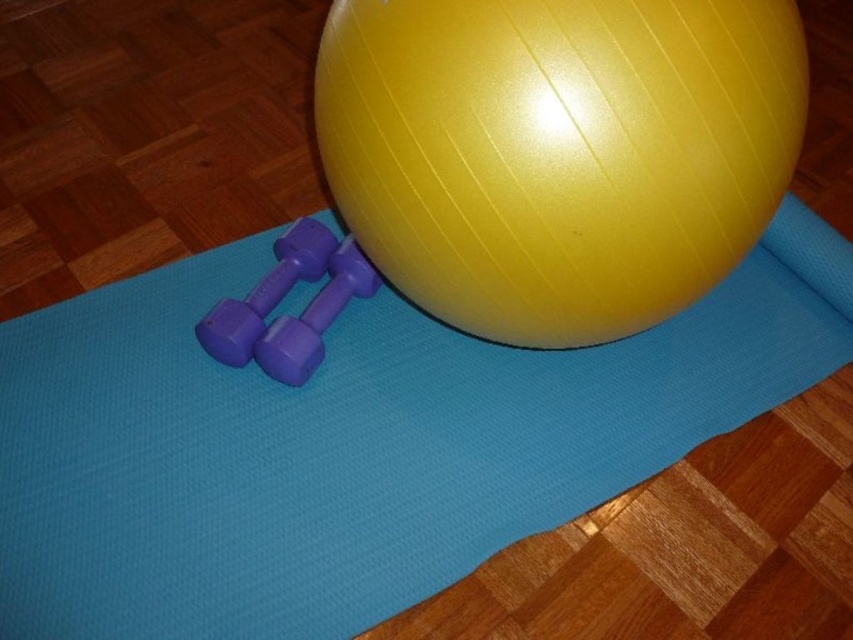
You are organizing a fitness class and need to place a new equipment on the blue rubber yoga mat at center. Considering the size of the purple rubber dumbbell at left, will it fit on the mat?

The blue rubber yoga mat at center has a larger size compared to the purple rubber dumbbell at left, so the dumbbell will fit on the mat.

You are setting up a workout area and want to place a small blue mat between the glossy yellow ball at center and the purple rubber dumbbells at center. Can the blue mat fit between them if the mat is 10 cm wide?

The glossy yellow ball at center is bigger than purple rubber dumbbells at center, but the description does not provide specific measurements for their sizes or the distance between them. Without knowing the exact dimensions or spacing, it is impossible to determine if the blue mat will fit between them.

You are setting up a home gym and need to place a new equipment that requires a surface taller than the blue rubber yoga mat at center. Can the purple rubber dumbbell at left provide enough height?

The blue rubber yoga mat at center is taller than the purple rubber dumbbell at left, so the purple rubber dumbbell at left is not tall enough to provide the required height for the new equipment.